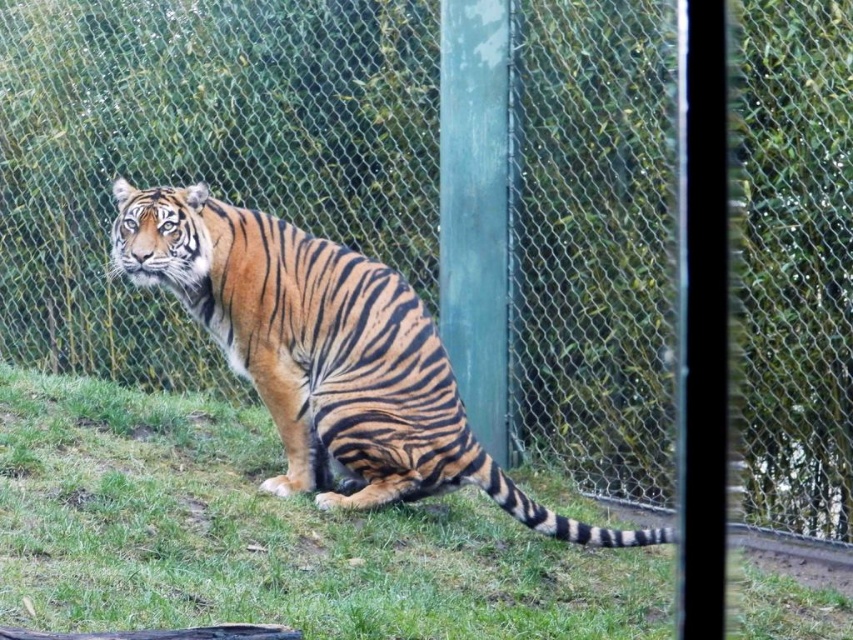
You are a zookeeper who needs to place a new feeding bowl for the tiger. The bowl requires a flat surface area of at least 0.5 square meters. Given the coordinates provided for the green grass at lower center, can you confirm if there is sufficient space to place the bowl there?

The green grass at lower center is located at point [268,536], but the provided information does not specify the size or area of the grassy spot. Therefore, it is unclear if there is enough space to place the feeding bowl.